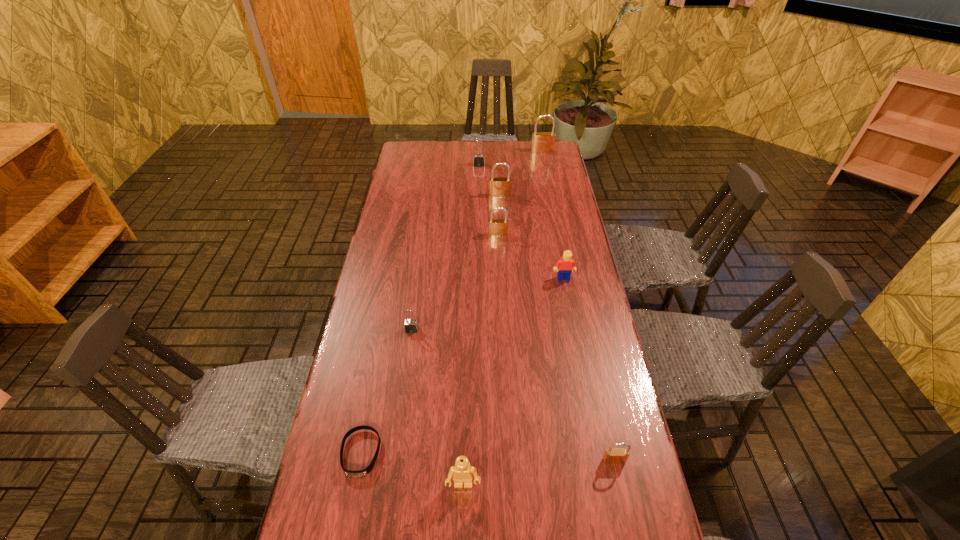
Where is `unoccupied area between the shortest object and the second farthest object`? This screenshot has height=540, width=960. unoccupied area between the shortest object and the second farthest object is located at coordinates (420, 309).

You are a GUI agent. You are given a task and a screenshot of the screen. Output one action in this format:
    pyautogui.click(x=<x>, y=<y>)
    Task: Click on the blank region between the fourth nearest padlock and the eighth object from right to left
    This screenshot has width=960, height=540.
    Given the screenshot: What is the action you would take?
    pyautogui.click(x=456, y=262)

At what (x,y) coordinates should I click in order to perform the action: click on empty space that is in between the left Lego and the farthest object. Please return your answer as a coordinate pair (x, y). The height and width of the screenshot is (540, 960). Looking at the image, I should click on (503, 318).

Identify which object is the fifth nearest to the third farthest padlock. Please provide its 2D coordinates. Your answer should be formatted as a tuple, i.e. [(x, y)], where the tuple contains the x and y coordinates of a point satisfying the conditions above.

[(411, 325)]

Locate which object is the third closest to the smallest brass padlock. Please provide its 2D coordinates. Your answer should be formatted as a tuple, i.e. [(x, y)], where the tuple contains the x and y coordinates of a point satisfying the conditions above.

[(566, 264)]

Where is `padlock that is the fifth closest to the fifth shortest padlock`? This screenshot has width=960, height=540. padlock that is the fifth closest to the fifth shortest padlock is located at coordinates point(612,456).

The image size is (960, 540). Find the location of `padlock that is the second nearest to the smallest brass padlock`. padlock that is the second nearest to the smallest brass padlock is located at coordinates (497, 227).

Select which brass padlock is the fourth closest to the bigger gray padlock. Please provide its 2D coordinates. Your answer should be formatted as a tuple, i.e. [(x, y)], where the tuple contains the x and y coordinates of a point satisfying the conditions above.

[(612, 456)]

Find the location of a particular element. Image resolution: width=960 pixels, height=540 pixels. the fourth closest brass padlock to the farther gray padlock is located at coordinates (612, 456).